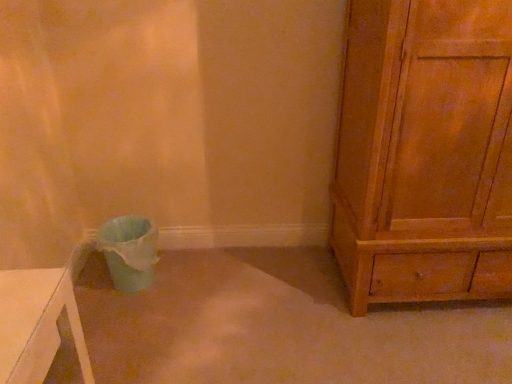
Question: In terms of size, does matte plastic potty at lower left appear bigger or smaller than wooden chest of drawers at right?

Choices:
 (A) small
 (B) big

Answer: (A)

Question: Relative to wooden chest of drawers at right, is matte plastic potty at lower left in front or behind?

Choices:
 (A) behind
 (B) front

Answer: (A)

Question: Does point (139, 259) appear closer or farther from the camera than point (384, 39)?

Choices:
 (A) farther
 (B) closer

Answer: (A)

Question: Considering the positions of wooden chest of drawers at right and matte plastic potty at lower left in the image, is wooden chest of drawers at right bigger or smaller than matte plastic potty at lower left?

Choices:
 (A) big
 (B) small

Answer: (A)

Question: Is wooden chest of drawers at right in front of or behind matte plastic potty at lower left in the image?

Choices:
 (A) front
 (B) behind

Answer: (A)

Question: Is wooden chest of drawers at right taller or shorter than matte plastic potty at lower left?

Choices:
 (A) short
 (B) tall

Answer: (B)

Question: Considering the relative positions of wooden chest of drawers at right and matte plastic potty at lower left in the image provided, is wooden chest of drawers at right to the left or to the right of matte plastic potty at lower left?

Choices:
 (A) right
 (B) left

Answer: (A)